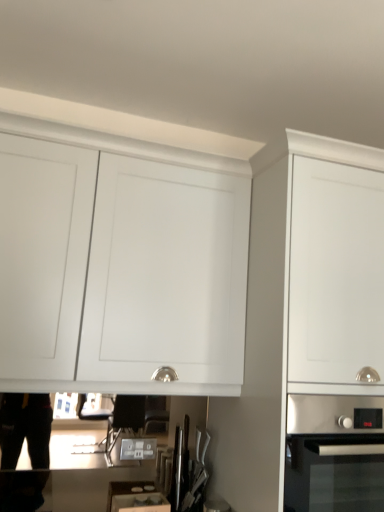
Question: Is stainless steel oven at lower right to the right of white matte cabinet at upper center, the second cabinetry positioned from the right, from the viewer's perspective?

Choices:
 (A) no
 (B) yes

Answer: (B)

Question: Is stainless steel oven at lower right positioned far away from white matte cabinet at upper center, placed as the 1th cabinetry when sorted from left to right?

Choices:
 (A) no
 (B) yes

Answer: (A)

Question: From the image's perspective, would you say stainless steel oven at lower right is shown under white matte cabinet at upper center, placed as the 1th cabinetry when sorted from left to right?

Choices:
 (A) no
 (B) yes

Answer: (B)

Question: From the image's perspective, is stainless steel oven at lower right over white matte cabinet at upper center, placed as the 1th cabinetry when sorted from left to right?

Choices:
 (A) yes
 (B) no

Answer: (B)

Question: Does stainless steel oven at lower right lie in front of white matte cabinet at upper center, the second cabinetry positioned from the right?

Choices:
 (A) yes
 (B) no

Answer: (A)

Question: Based on their positions, is white matte cabinet at upper center, the second cabinetry positioned from the right, located to the left or right of matte white drawer at lower center?

Choices:
 (A) right
 (B) left

Answer: (B)

Question: Is white matte cabinet at upper center, placed as the 1th cabinetry when sorted from left to right, situated inside matte white drawer at lower center or outside?

Choices:
 (A) outside
 (B) inside

Answer: (A)

Question: Is point (16, 242) closer or farther from the camera than point (132, 498)?

Choices:
 (A) farther
 (B) closer

Answer: (B)

Question: From a real-world perspective, is white matte cabinet at upper center, the second cabinetry positioned from the right, physically located above or below matte white drawer at lower center?

Choices:
 (A) above
 (B) below

Answer: (A)

Question: Relative to stainless steel oven at lower right, is stainless steel knife block at center in front or behind?

Choices:
 (A) front
 (B) behind

Answer: (B)

Question: Visually, is stainless steel knife block at center positioned to the left or to the right of stainless steel oven at lower right?

Choices:
 (A) left
 (B) right

Answer: (A)

Question: From the image's perspective, is stainless steel knife block at center positioned above or below stainless steel oven at lower right?

Choices:
 (A) above
 (B) below

Answer: (B)

Question: Based on their sizes in the image, would you say stainless steel knife block at center is bigger or smaller than stainless steel oven at lower right?

Choices:
 (A) small
 (B) big

Answer: (A)

Question: Is white matte cabinet at upper center, placed as the 1th cabinetry when sorted from left to right, wider or thinner than stainless steel oven at lower right?

Choices:
 (A) wide
 (B) thin

Answer: (B)

Question: Is white matte cabinet at upper center, the second cabinetry positioned from the right, taller or shorter than stainless steel oven at lower right?

Choices:
 (A) tall
 (B) short

Answer: (A)